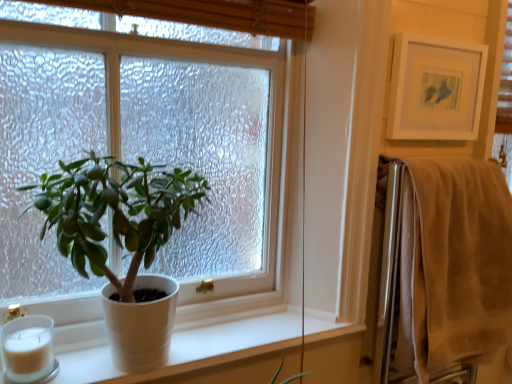
Question: Is white matte pot at left taller than beige cotton towel at right?

Choices:
 (A) no
 (B) yes

Answer: (A)

Question: Can you see white matte pot at left touching beige cotton towel at right?

Choices:
 (A) yes
 (B) no

Answer: (B)

Question: Is white matte pot at left bigger than beige cotton towel at right?

Choices:
 (A) yes
 (B) no

Answer: (A)

Question: From the image's perspective, would you say white matte pot at left is positioned over beige cotton towel at right?

Choices:
 (A) yes
 (B) no

Answer: (A)

Question: Does white matte pot at left have a greater width compared to beige cotton towel at right?

Choices:
 (A) no
 (B) yes

Answer: (B)

Question: From a real-world perspective, does white matte pot at left sit lower than beige cotton towel at right?

Choices:
 (A) no
 (B) yes

Answer: (A)

Question: Does white matte picture frame at upper right have a lesser width compared to white matte candle at lower left?

Choices:
 (A) yes
 (B) no

Answer: (A)

Question: Can white matte candle at lower left be found inside white matte picture frame at upper right?

Choices:
 (A) yes
 (B) no

Answer: (B)

Question: Considering the relative sizes of white matte picture frame at upper right and white matte candle at lower left in the image provided, is white matte picture frame at upper right shorter than white matte candle at lower left?

Choices:
 (A) yes
 (B) no

Answer: (B)

Question: Is white matte picture frame at upper right bigger than white matte candle at lower left?

Choices:
 (A) no
 (B) yes

Answer: (B)

Question: From a real-world perspective, is white matte picture frame at upper right physically below white matte candle at lower left?

Choices:
 (A) no
 (B) yes

Answer: (A)

Question: Does white matte picture frame at upper right appear on the left side of white matte candle at lower left?

Choices:
 (A) no
 (B) yes

Answer: (A)

Question: From a real-world perspective, is white matte candle at lower left beneath beige cotton towel at right?

Choices:
 (A) yes
 (B) no

Answer: (A)